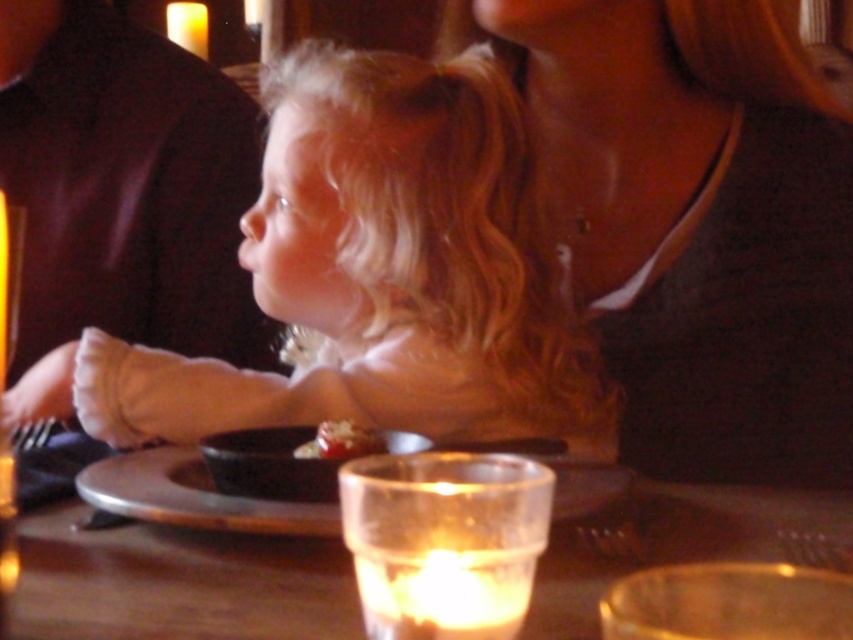
Question: From the image, what is the correct spatial relationship of matte black shirt at upper left in relation to smooth chocolate cake at center?

Choices:
 (A) below
 (B) above

Answer: (B)

Question: Which object is positioned farthest from the matte gold necklace at upper center?

Choices:
 (A) transparent glass candle at center
 (B) matte black shirt at upper left

Answer: (B)

Question: Does transparent glass candle at center have a lesser width compared to smooth chocolate cake at center?

Choices:
 (A) no
 (B) yes

Answer: (A)

Question: Is transparent glass candle at center to the left of smooth chocolate cake at center from the viewer's perspective?

Choices:
 (A) no
 (B) yes

Answer: (A)

Question: Among these points, which one is nearest to the camera?

Choices:
 (A) (181, 634)
 (B) (831, 275)
 (C) (186, 262)
 (D) (277, 154)

Answer: (A)

Question: Which point is closer to the camera?

Choices:
 (A) (155, 214)
 (B) (152, 534)
 (C) (311, 144)
 (D) (338, 426)

Answer: (B)